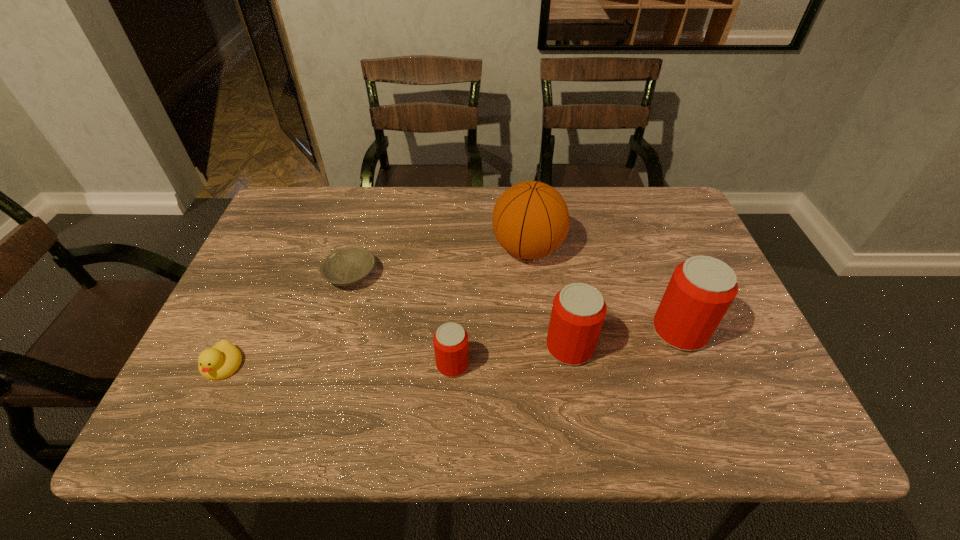
The width and height of the screenshot is (960, 540). Find the location of `vacant space located 0.080m on the right of the third object from left to right`. vacant space located 0.080m on the right of the third object from left to right is located at coordinates (506, 364).

Find the location of a particular element. free location located on the left of the second tallest beer can is located at coordinates (395, 347).

This screenshot has width=960, height=540. Identify the location of vacant space located 0.340m on the back of the rightmost object. 636,221.

Where is `vacant area situated 0.210m on the back of the bowl`? The image size is (960, 540). vacant area situated 0.210m on the back of the bowl is located at coordinates (370, 210).

The height and width of the screenshot is (540, 960). What are the coordinates of `free space located on the left of the basketball` in the screenshot? It's located at (361, 249).

At what (x,y) coordinates should I click in order to perform the action: click on object that is at the far edge. Please return your answer as a coordinate pair (x, y). The height and width of the screenshot is (540, 960). Looking at the image, I should click on (530, 220).

The height and width of the screenshot is (540, 960). Identify the location of duckling that is at the near edge. (223, 359).

Find the location of a particular element. Image resolution: width=960 pixels, height=540 pixels. object that is positioned at the left edge is located at coordinates (x=223, y=359).

I want to click on object at the right edge, so click(701, 289).

Find the location of a particular element. object that is at the near left corner is located at coordinates (223, 359).